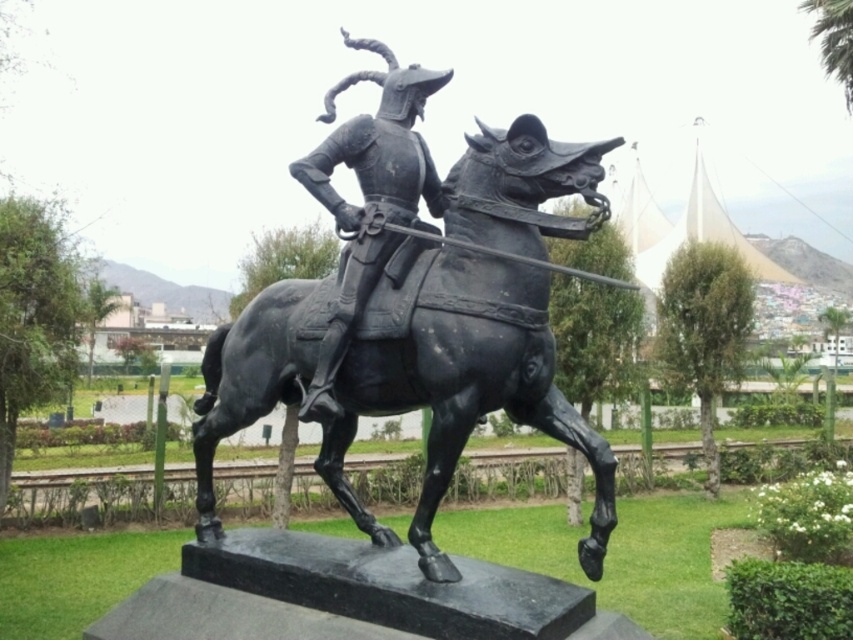
Is black polished horse at center positioned in front of black polished metal horseman at center?

Yes, it is.

Who is positioned more to the right, black polished horse at center or black polished metal horseman at center?

Positioned to the right is black polished horse at center.

Is point (552, 396) in front of point (323, 353)?

No.

The width and height of the screenshot is (853, 640). In order to click on black polished horse at center in this screenshot , I will do `click(463, 390)`.